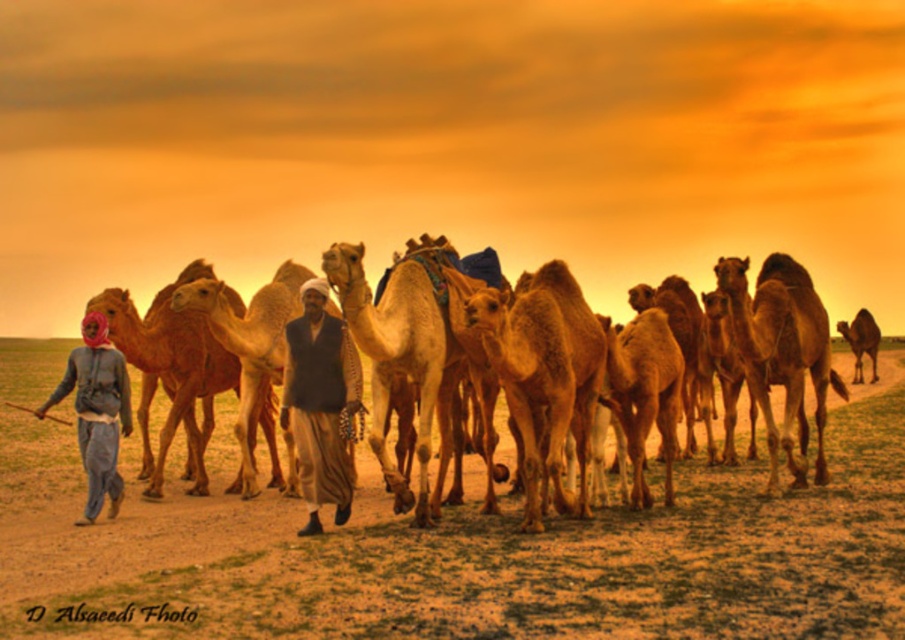
Is brown textured sand at center in front of fuzzy beige camel at center?

Yes, it is.

Image resolution: width=905 pixels, height=640 pixels. Describe the element at coordinates (470, 556) in the screenshot. I see `brown textured sand at center` at that location.

Identify the location of brown textured sand at center. (470, 556).

Who is shorter, dark brown woolen vest at center or denim jacket at left?

denim jacket at left is shorter.

Can you confirm if dark brown woolen vest at center is positioned to the left of denim jacket at left?

In fact, dark brown woolen vest at center is to the right of denim jacket at left.

Where is `dark brown woolen vest at center`? dark brown woolen vest at center is located at coordinates (320, 403).

Locate an element on the screen. The width and height of the screenshot is (905, 640). dark brown woolen vest at center is located at coordinates (320, 403).

Describe the element at coordinates (470, 556) in the screenshot. I see `brown textured sand at center` at that location.

Is point (656, 602) positioned before point (98, 465)?

That is True.

The height and width of the screenshot is (640, 905). Identify the location of brown textured sand at center. (470, 556).